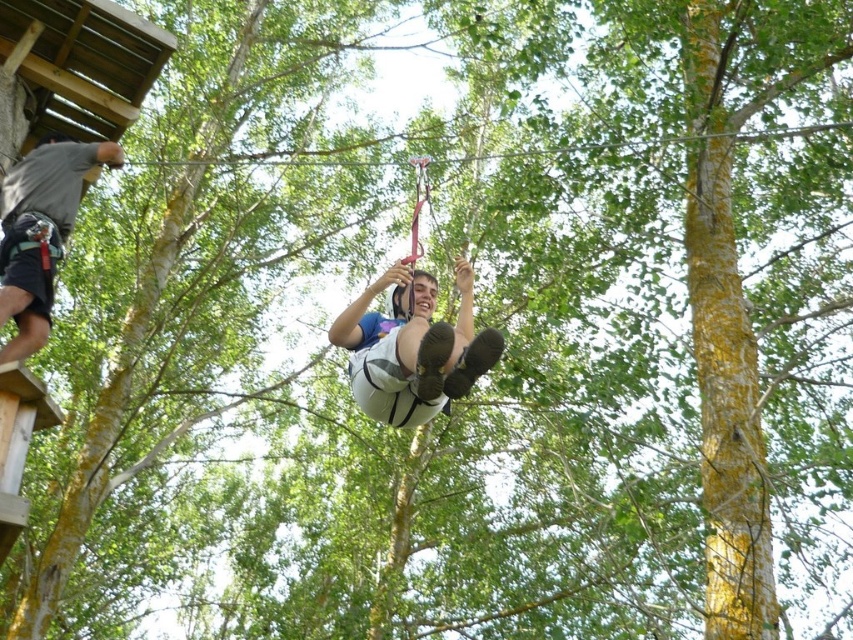
You are a drone operator trying to capture the best shot of the zip line harness. The harness is at point (413, 348). Where should you position your drone to get a clear view of the white fabric harness at center?

The white fabric harness at center is located at point (413, 348), so you should position your drone directly above that coordinate to get a clear view.

You are a safety inspector checking zip line equipment. You see the white fabric harness at center and the gray fabric harness at upper left. Which harness is positioned closer to you?

The white fabric harness at center is closer to the viewer than the gray fabric harness at upper left.